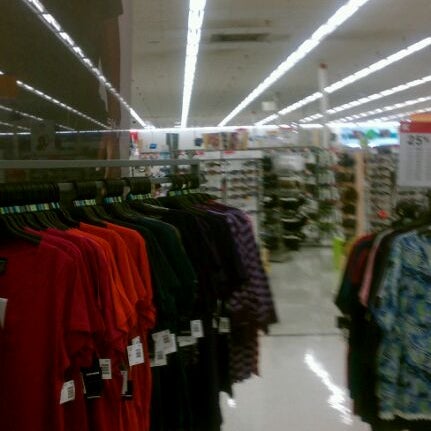
Where is `racks`? The width and height of the screenshot is (431, 431). racks is located at coordinates (294, 165).